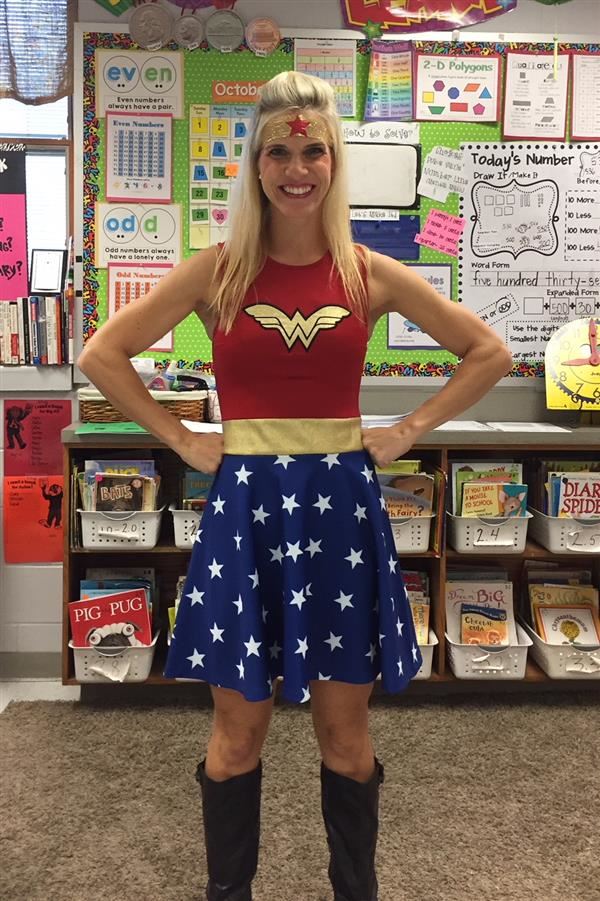
The image size is (600, 901). Find the location of `bulletin board`. bulletin board is located at coordinates (443, 153).